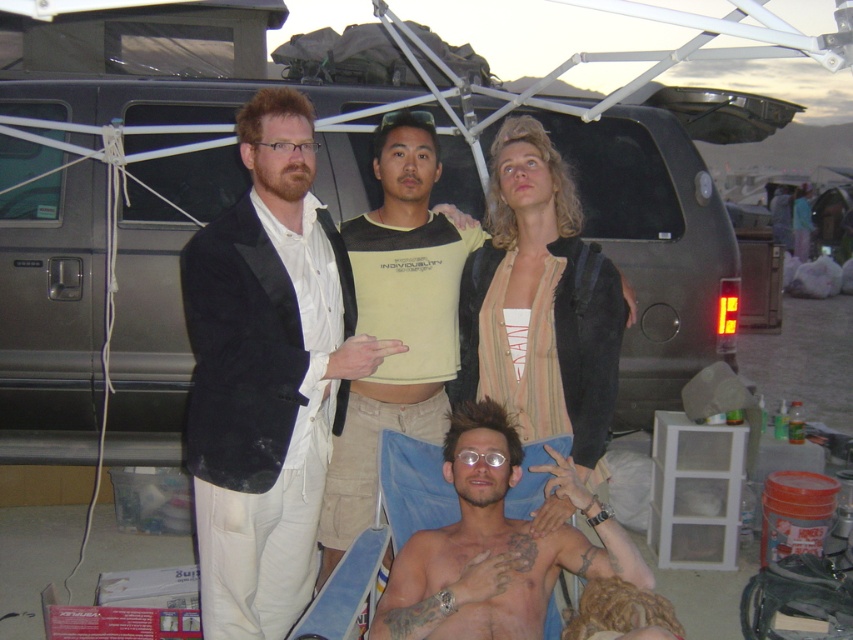
Question: Which of these objects is positioned closest to the metallic silver suv at center?

Choices:
 (A) shiny silver hair at center
 (B) light yellow jersey at center
 (C) striped fabric shirt at upper center

Answer: (B)

Question: Does metallic silver suv at center come behind light yellow jersey at center?

Choices:
 (A) yes
 (B) no

Answer: (A)

Question: Is metallic silver suv at center to the right of matte black suit at center from the viewer's perspective?

Choices:
 (A) no
 (B) yes

Answer: (A)

Question: Is metallic silver suv at center positioned at the back of matte black suit at center?

Choices:
 (A) no
 (B) yes

Answer: (B)

Question: Which of the following is the farthest from the observer?

Choices:
 (A) (445, 170)
 (B) (526, 376)

Answer: (A)

Question: Which point is closer to the camera taking this photo?

Choices:
 (A) (415, 176)
 (B) (206, 616)
 (C) (578, 312)

Answer: (B)